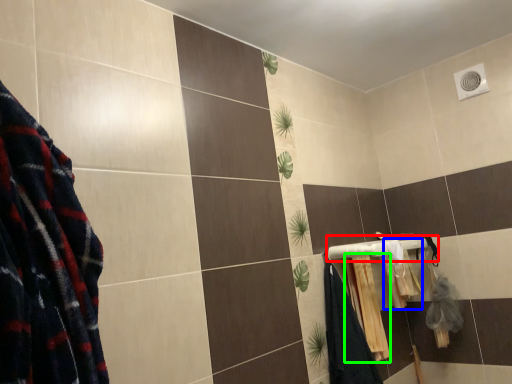
Question: Which object is the farthest from towel bar (highlighted by a red box)? Choose among these: bath towel (highlighted by a blue box) or bath towel (highlighted by a green box).

Choices:
 (A) bath towel
 (B) bath towel

Answer: (B)